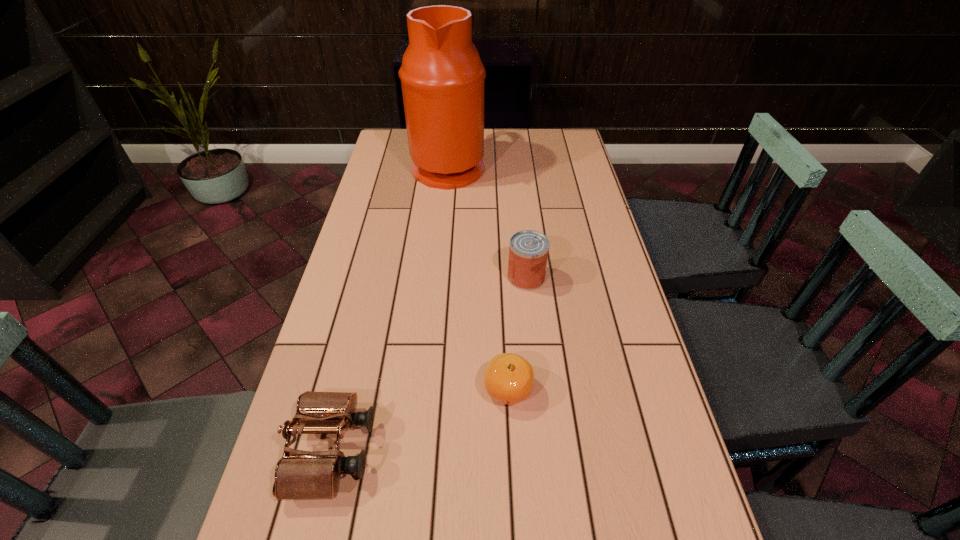
The image size is (960, 540). What are the coordinates of `object that stands as the second closest to the clementine` in the screenshot? It's located at (528, 251).

I want to click on vacant position in the image that satisfies the following two spatial constraints: 1. on the back side of the third shortest object; 2. from the spout of the tallest object, so click(x=515, y=166).

Identify the location of vacant space that satisfies the following two spatial constraints: 1. from the spout of the third nearest object; 2. on the right side of the farthest object. The image size is (960, 540). (438, 277).

I want to click on free spot that satisfies the following two spatial constraints: 1. on the back side of the can; 2. from the spout of the tallest object, so click(515, 166).

The width and height of the screenshot is (960, 540). Identify the location of free spot that satisfies the following two spatial constraints: 1. on the front side of the clementine; 2. through the eyepieces of the binoculars. (511, 450).

In order to click on vacant region that satisfies the following two spatial constraints: 1. from the spout of the farthest object; 2. on the left side of the clementine in this screenshot , I will do `click(427, 389)`.

You are a GUI agent. You are given a task and a screenshot of the screen. Output one action in this format:
    pyautogui.click(x=<x>, y=<y>)
    Task: Click on the free space that satisfies the following two spatial constraints: 1. from the spout of the farthest object; 2. on the left side of the can
    This screenshot has width=960, height=540.
    Given the screenshot: What is the action you would take?
    pyautogui.click(x=438, y=277)